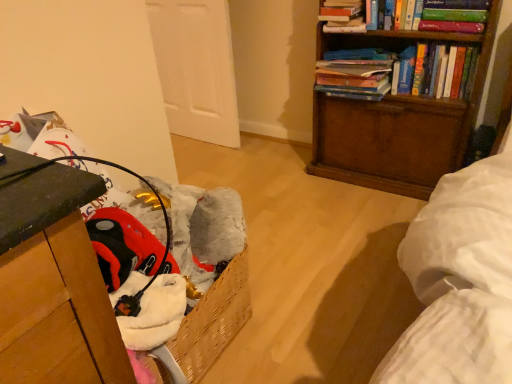
Question: Would you say wooden bookcase at upper right is part of hardcover book at upper right, which is the 1th book from left to right,'s contents?

Choices:
 (A) yes
 (B) no

Answer: (B)

Question: Does hardcover book at upper right, the 3th book from the right, have a larger size compared to wooden bookcase at upper right?

Choices:
 (A) yes
 (B) no

Answer: (B)

Question: Considering the relative sizes of hardcover book at upper right, the 3th book from the right, and wooden bookcase at upper right in the image provided, is hardcover book at upper right, the 3th book from the right, thinner than wooden bookcase at upper right?

Choices:
 (A) no
 (B) yes

Answer: (B)

Question: Considering the relative sizes of hardcover book at upper right, which is the 1th book from left to right, and wooden bookcase at upper right in the image provided, is hardcover book at upper right, which is the 1th book from left to right, wider than wooden bookcase at upper right?

Choices:
 (A) yes
 (B) no

Answer: (B)

Question: Considering the relative sizes of hardcover book at upper right, which is the 1th book from left to right, and wooden bookcase at upper right in the image provided, is hardcover book at upper right, which is the 1th book from left to right, smaller than wooden bookcase at upper right?

Choices:
 (A) yes
 (B) no

Answer: (A)

Question: Is hardcover book at upper right, the 3th book from the right, next to wooden bookcase at upper right?

Choices:
 (A) yes
 (B) no

Answer: (B)

Question: From the image's perspective, is hardcover books at upper right, the third book from the left, located beneath wooden bookcase at upper right?

Choices:
 (A) no
 (B) yes

Answer: (A)

Question: Is hardcover books at upper right, the 1th book when ordered from right to left, facing towards wooden bookcase at upper right?

Choices:
 (A) no
 (B) yes

Answer: (B)

Question: Is hardcover books at upper right, the 1th book when ordered from right to left, beside wooden bookcase at upper right?

Choices:
 (A) no
 (B) yes

Answer: (A)

Question: Is hardcover books at upper right, the third book from the left, at the left side of wooden bookcase at upper right?

Choices:
 (A) no
 (B) yes

Answer: (A)

Question: Does hardcover books at upper right, the third book from the left, have a lesser width compared to wooden bookcase at upper right?

Choices:
 (A) no
 (B) yes

Answer: (B)

Question: Does hardcover books at upper right, the 1th book when ordered from right to left, have a larger size compared to wooden bookcase at upper right?

Choices:
 (A) no
 (B) yes

Answer: (A)

Question: Could you tell me if wooden bookcase at upper right is turned towards hardcover books at upper right, the 2th book from the right?

Choices:
 (A) yes
 (B) no

Answer: (A)